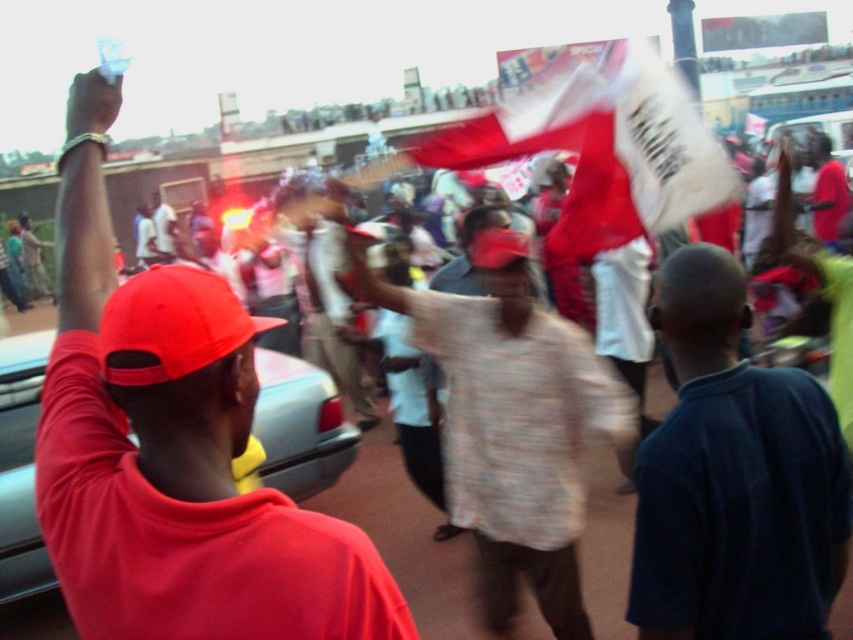
Is point (83, 541) behind point (560, 323)?

No, it is in front of (560, 323).

Can you confirm if matte red cap at left is wider than light brown textured shirt at center?

No, matte red cap at left is not wider than light brown textured shirt at center.

Who is more distant from viewer, (73,216) or (621,400)?

Positioned behind is point (621,400).

This screenshot has height=640, width=853. I want to click on matte red cap at left, so click(173, 449).

Which is above, light brown textured shirt at center or matte red cap at upper left?

matte red cap at upper left

Can you confirm if light brown textured shirt at center is shorter than matte red cap at upper left?

Correct, light brown textured shirt at center is not as tall as matte red cap at upper left.

Does point (547, 593) come farther from viewer compared to point (160, 212)?

No, (547, 593) is in front of (160, 212).

Find the location of a particular element. The width and height of the screenshot is (853, 640). light brown textured shirt at center is located at coordinates (514, 428).

Does light brown textured shirt at center have a larger size compared to metallic gray car at left?

Indeed, light brown textured shirt at center has a larger size compared to metallic gray car at left.

Can you confirm if light brown textured shirt at center is taller than metallic gray car at left?

Yes.

Describe the element at coordinates (514, 428) in the screenshot. This screenshot has width=853, height=640. I see `light brown textured shirt at center` at that location.

Identify the location of light brown textured shirt at center. The height and width of the screenshot is (640, 853). (514, 428).